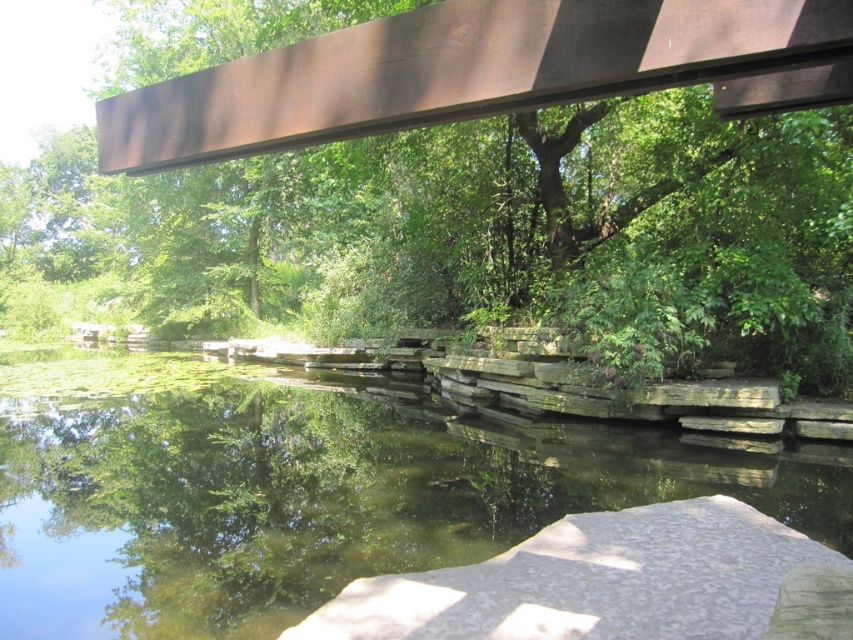
You are a photographer planning to capture the rusty metal beam at upper center and the greenish stone river at center in a single frame. Based on their sizes, which object will occupy more space in your photo?

The rusty metal beam at upper center has a larger size compared to the greenish stone river at center, so it will occupy more space in the photo.